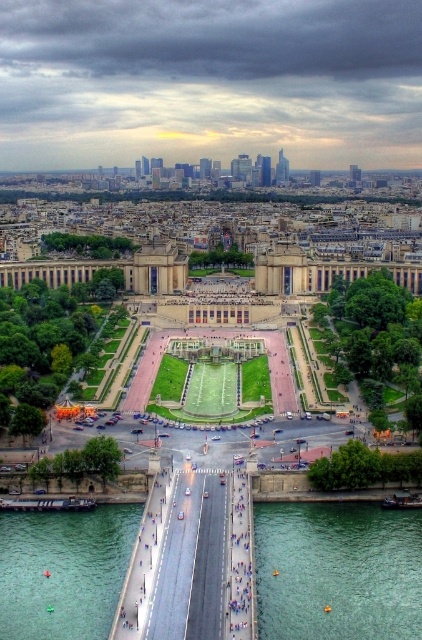
Question: Is green water at bridge right closer to the viewer compared to green water at bridge center?

Choices:
 (A) yes
 (B) no

Answer: (A)

Question: Which point is farther from the camera taking this photo?

Choices:
 (A) (403, 625)
 (B) (19, 612)

Answer: (B)

Question: Is green water at bridge right closer to camera compared to green water at bridge center?

Choices:
 (A) yes
 (B) no

Answer: (A)

Question: Which object appears closest to the camera in this image?

Choices:
 (A) green water at bridge right
 (B) green water at bridge center

Answer: (A)

Question: Can you confirm if green water at bridge right is wider than green water at bridge center?

Choices:
 (A) no
 (B) yes

Answer: (B)